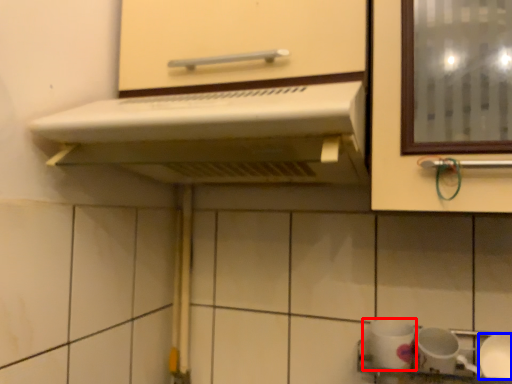
Question: Which object appears closest to the camera in this image, tableware (highlighted by a red box) or tableware (highlighted by a blue box)?

Choices:
 (A) tableware
 (B) tableware

Answer: (B)